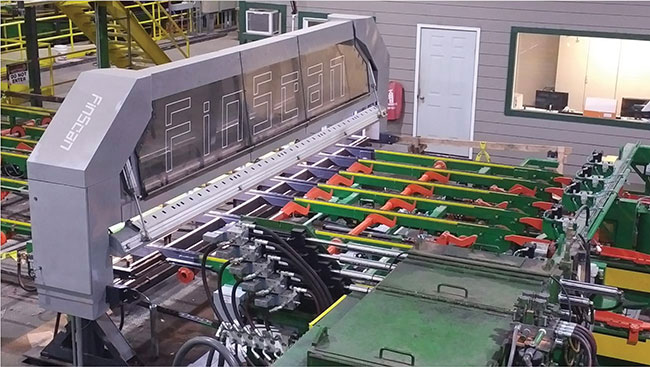
Identify the location of stairs. Image resolution: width=650 pixels, height=367 pixels. (145, 41).